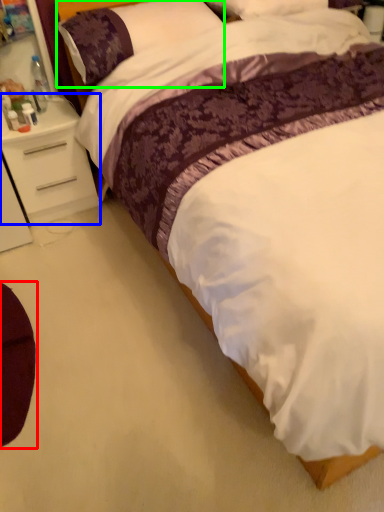
Question: Which is farther away from swivel chair (highlighted by a red box)? nightstand (highlighted by a blue box) or pillow (highlighted by a green box)?

Choices:
 (A) nightstand
 (B) pillow

Answer: (B)